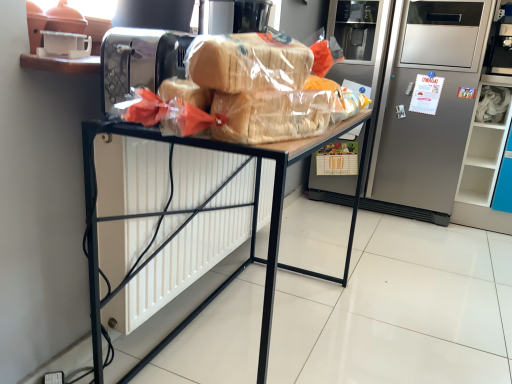
Question: Is translucent plastic bread at center inside or outside of satin silver refrigerator at center?

Choices:
 (A) outside
 (B) inside

Answer: (A)

Question: From their relative heights in the image, would you say translucent plastic bread at center is taller or shorter than satin silver refrigerator at center?

Choices:
 (A) short
 (B) tall

Answer: (A)

Question: Which object is positioned farthest from the translucent plastic bread at center?

Choices:
 (A) satin silver refrigerator at center
 (B) translucent plastic bread at center
 (C) wooden desk at center

Answer: (A)

Question: Which object is positioned farthest from the translucent plastic bread at center?

Choices:
 (A) translucent plastic bread at center
 (B) satin silver refrigerator at center
 (C) wooden desk at center

Answer: (B)